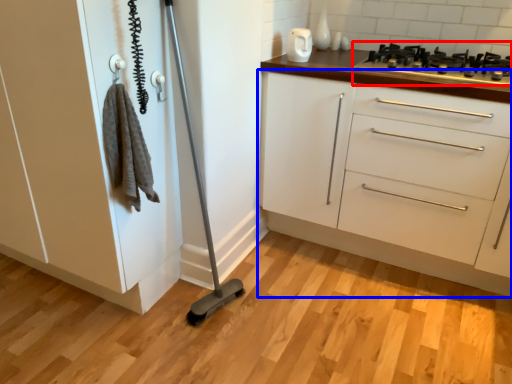
Question: Which object appears closest to the camera in this image, gas stove (highlighted by a red box) or chest of drawers (highlighted by a blue box)?

Choices:
 (A) gas stove
 (B) chest of drawers

Answer: (B)